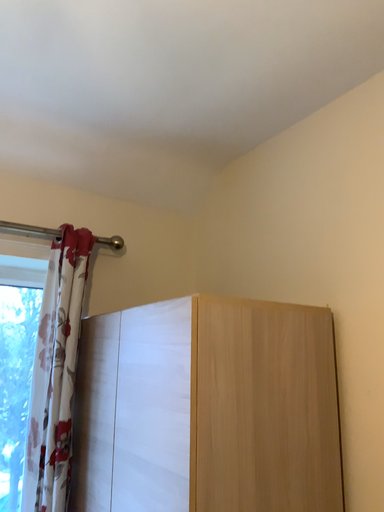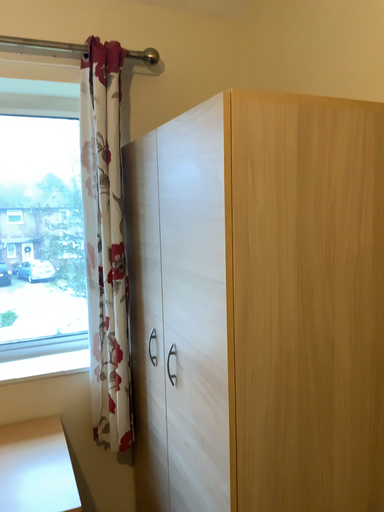
Question: How did the camera likely rotate when shooting the video?

Choices:
 (A) rotated right
 (B) rotated left

Answer: (B)